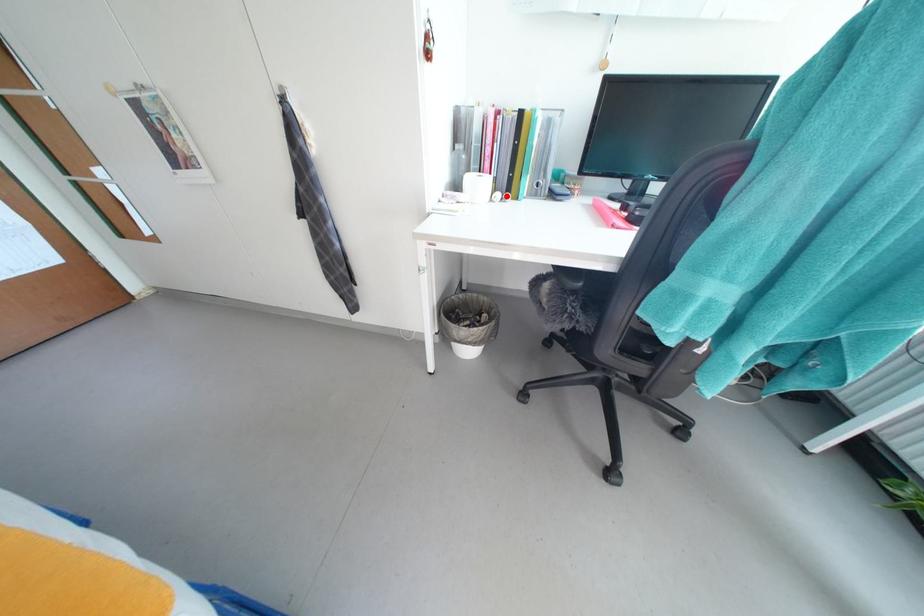
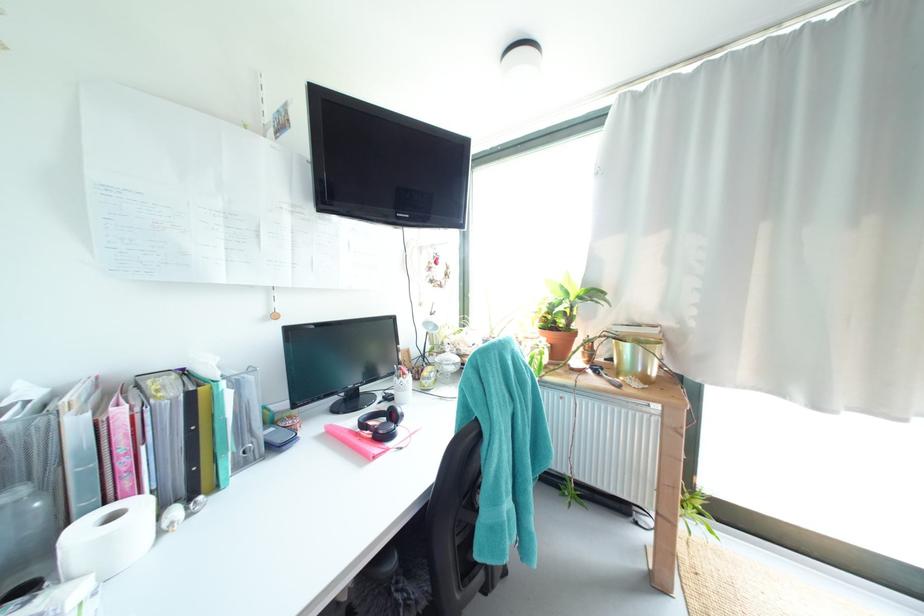
Locate, in the second image, the point that corresponds to the highlighted location in the first image.

(185, 513)